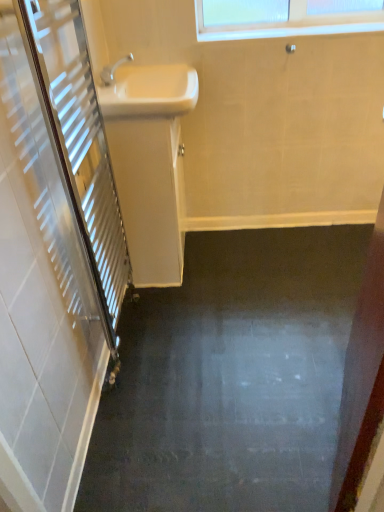
Question: From the image's perspective, is white glossy sink at upper center, which is the 1th sink in top-to-bottom order, located above or below white glossy sink at upper center, which is the second sink from top to bottom?

Choices:
 (A) above
 (B) below

Answer: (A)

Question: From their relative heights in the image, would you say white glossy sink at upper center, which is the 1th sink in top-to-bottom order, is taller or shorter than white glossy sink at upper center, which is the second sink from top to bottom?

Choices:
 (A) short
 (B) tall

Answer: (A)

Question: In terms of width, does white glossy sink at upper center, which is the 1th sink in top-to-bottom order, look wider or thinner when compared to white glossy sink at upper center, the first sink when ordered from bottom to top?

Choices:
 (A) wide
 (B) thin

Answer: (A)

Question: From the image's perspective, is white glossy sink at upper center, the first sink when ordered from bottom to top, above or below white glossy sink at upper center, which ranks as the second sink in bottom-to-top order?

Choices:
 (A) below
 (B) above

Answer: (A)

Question: Is point (139, 207) positioned closer to the camera than point (137, 80)?

Choices:
 (A) farther
 (B) closer

Answer: (B)

Question: From a real-world perspective, is white glossy sink at upper center, which is the second sink from top to bottom, physically located above or below white glossy sink at upper center, which ranks as the second sink in bottom-to-top order?

Choices:
 (A) below
 (B) above

Answer: (A)

Question: Is white glossy sink at upper center, which is the second sink from top to bottom, wider or thinner than white glossy sink at upper center, which ranks as the second sink in bottom-to-top order?

Choices:
 (A) thin
 (B) wide

Answer: (A)